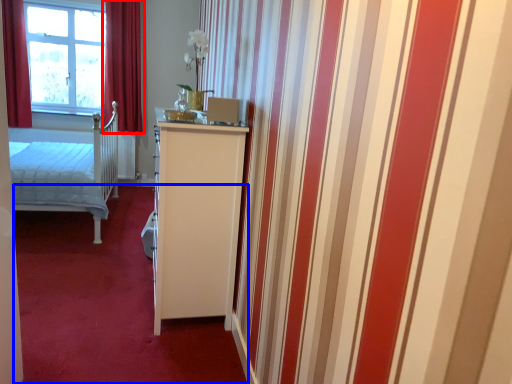
Question: Which point is closer to the camera, curtain (highlighted by a red box) or plain (highlighted by a blue box)?

Choices:
 (A) curtain
 (B) plain

Answer: (B)